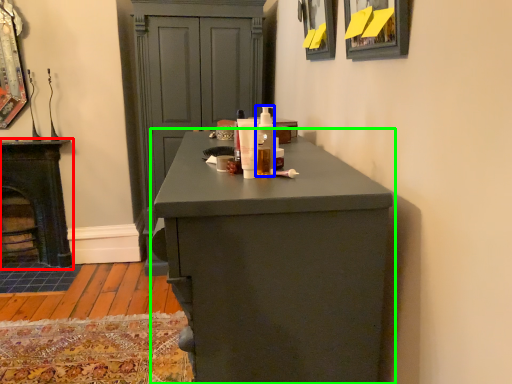
Question: Based on their relative distances, which object is farther from stove (highlighted by a red box)? Choose from mouthwash (highlighted by a blue box) and chest of drawers (highlighted by a green box).

Choices:
 (A) mouthwash
 (B) chest of drawers

Answer: (B)